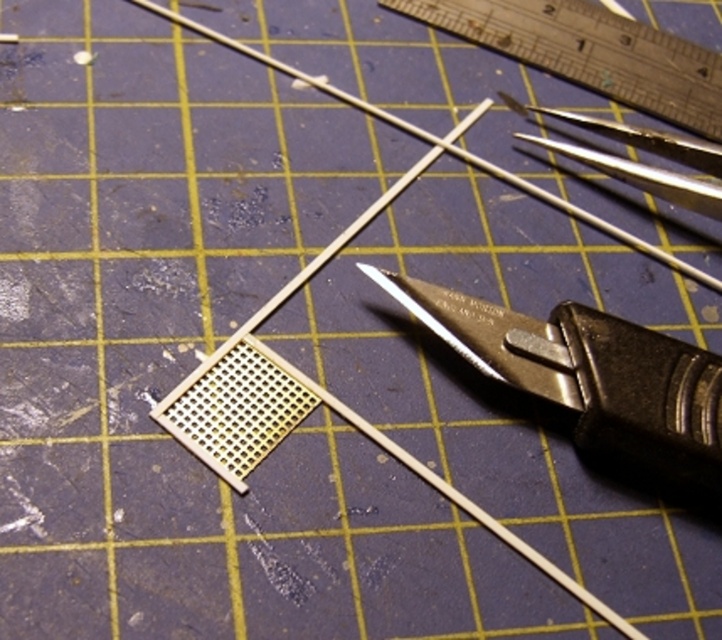
What object is located at the coordinates point (x=591, y=376) on the workbench surface?

The point (x=591, y=376) marks the location of the black plastic utility knife at center.

You are trying to locate the point at coordinates (591, 52) on the workbench. Based on the description, where is this point located?

The point at coordinates (591, 52) is located on the metallic silver ruler at upper right.

In the scene shown: You are looking at the workbench and notice two points marked on the cutting mat. The first point is at coordinates point (x=692, y=465) and the second is at point (x=604, y=52). Which of these points is closer to you?

Point (x=692, y=465) is closer to the camera than point (x=604, y=52).